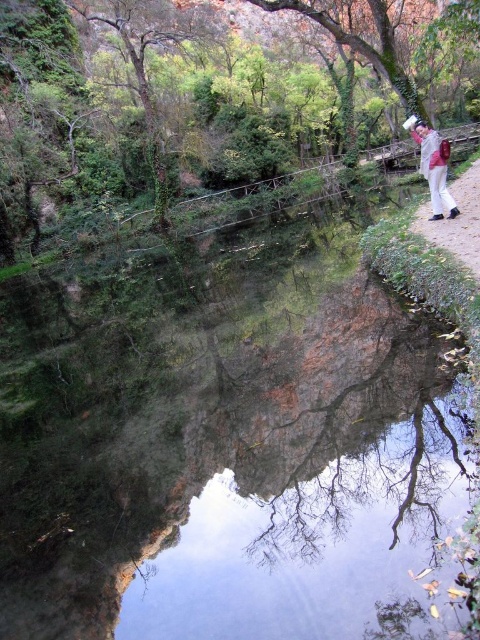
Question: Can you confirm if green leafy tree at upper center is positioned to the right of brown dirt path at right?

Choices:
 (A) yes
 (B) no

Answer: (B)

Question: Estimate the real-world distances between objects in this image. Which object is farther from the white cotton pants at center?

Choices:
 (A) brown dirt path at right
 (B) green leafy tree at upper center

Answer: (B)

Question: Which is farther from the brown dirt path at right?

Choices:
 (A) white cotton pants at center
 (B) green leafy tree at upper center

Answer: (B)

Question: Which of the following is the closest to the observer?

Choices:
 (A) (475, 198)
 (B) (420, 70)

Answer: (A)

Question: Is brown dirt path at right to the left of white cotton pants at center from the viewer's perspective?

Choices:
 (A) no
 (B) yes

Answer: (A)

Question: Does brown dirt path at right have a smaller size compared to white cotton pants at center?

Choices:
 (A) no
 (B) yes

Answer: (B)